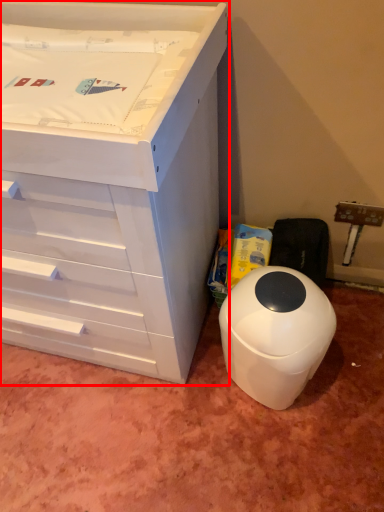
Question: Observing the image, what is the correct spatial positioning of chest of drawers (annotated by the red box) in reference to waste container?

Choices:
 (A) left
 (B) right

Answer: (A)